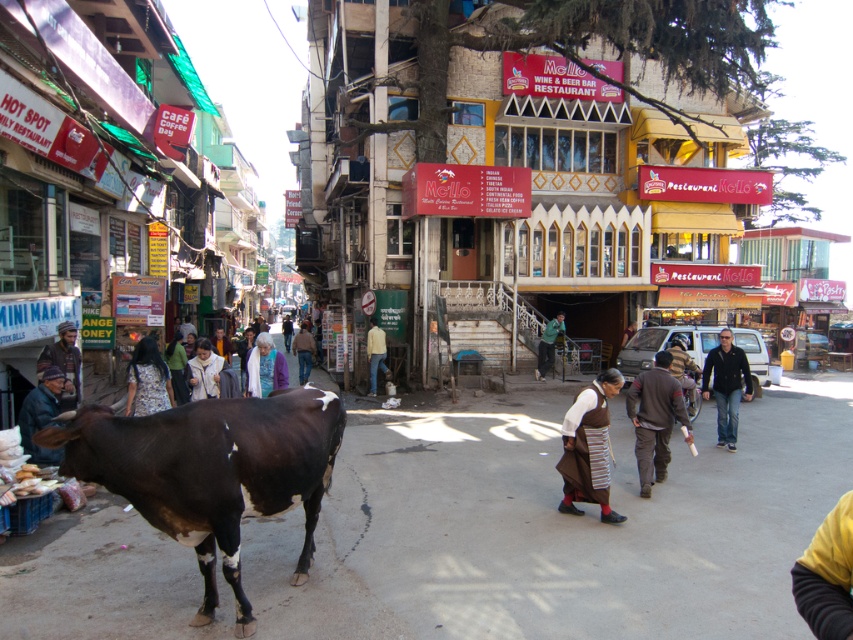
You are a customer in a bustling Indian market. You see a brown woolen sweater at lower right and a dark brown leather jacket at lower left. You want to pick up both items to try them on. Can you walk directly between them without needing to move any other items?

The brown woolen sweater at lower right and dark brown leather jacket at lower left are 7.35 meters apart, so you can walk directly between them as there is enough space between the two items.

You are a tourist standing in the middle of the street in this lively Indian town. You see two points marked on the ground ahead of you. The first point is at coordinate point(657, 417) and the second is at point(51, 394). Which point is closer to you?

Point(51, 394) is closer to you because it is less further away than point(657, 417).